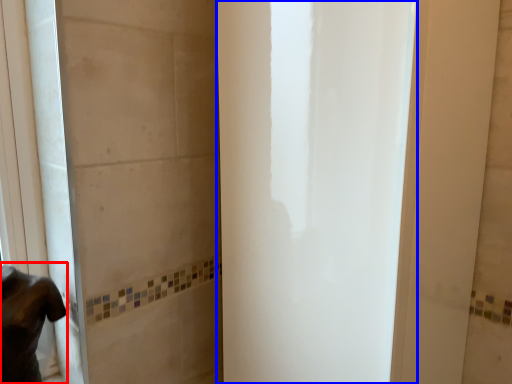
Question: Which object is further to the camera taking this photo, person (highlighted by a red box) or screen door (highlighted by a blue box)?

Choices:
 (A) person
 (B) screen door

Answer: (A)